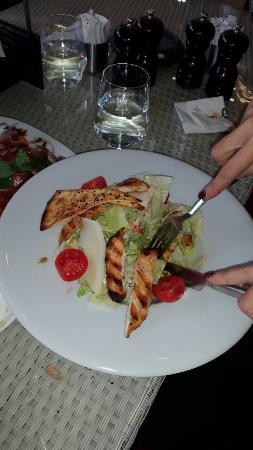
This screenshot has width=253, height=450. Find the location of `glass`. glass is located at coordinates (111, 104).